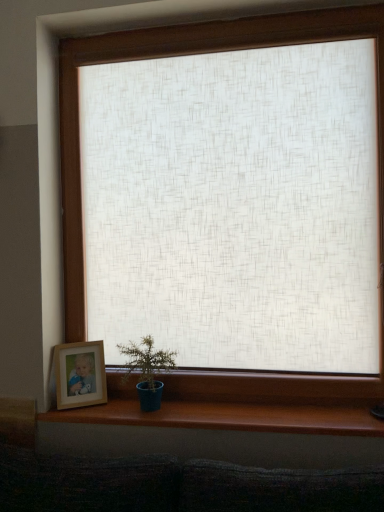
You are a GUI agent. You are given a task and a screenshot of the screen. Output one action in this format:
    pyautogui.click(x=<x>, y=<y>)
    Task: Click on the vacant region under blue matte pot at lower left (from a real-world perspective)
    The height and width of the screenshot is (512, 384).
    Given the screenshot: What is the action you would take?
    pyautogui.click(x=144, y=408)